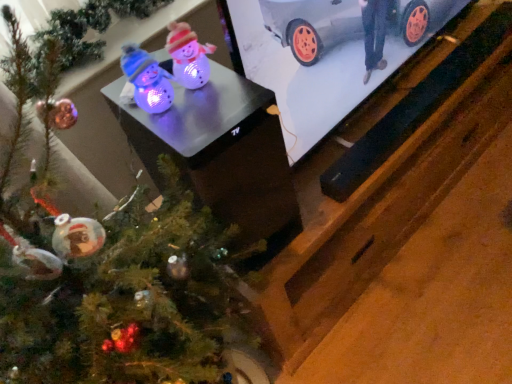
Question: Does point (224, 317) appear closer or farther from the camera than point (204, 145)?

Choices:
 (A) closer
 (B) farther

Answer: (B)

Question: From a real-world perspective, relative to matte plastic table at center, is green matte christmas tree at lower left vertically above or below?

Choices:
 (A) below
 (B) above

Answer: (A)

Question: Estimate the real-world distances between objects in this image. Which object is closer to the green matte christmas tree at lower left?

Choices:
 (A) metallic silver car at upper right
 (B) matte plastic table at center

Answer: (B)

Question: Which is nearer to the matte plastic table at center?

Choices:
 (A) metallic silver car at upper right
 (B) green matte christmas tree at lower left

Answer: (B)